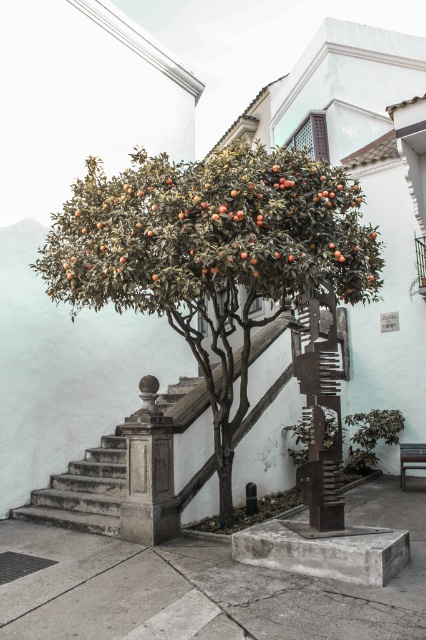
Question: In this image, where is green leafy tree at center located relative to gray concrete stairs at center?

Choices:
 (A) below
 (B) above

Answer: (B)

Question: Is green leafy tree at center in front of gray concrete stairs at center?

Choices:
 (A) no
 (B) yes

Answer: (B)

Question: Which of the following is the farthest from the observer?

Choices:
 (A) (109, 465)
 (B) (85, 195)

Answer: (A)

Question: Among these points, which one is farthest from the camera?

Choices:
 (A) (52, 237)
 (B) (62, 516)

Answer: (B)

Question: Is green leafy tree at center to the left of gray concrete stairs at center from the viewer's perspective?

Choices:
 (A) no
 (B) yes

Answer: (A)